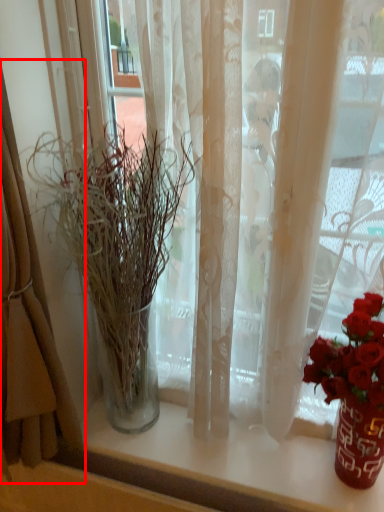
Question: From the image's perspective, where is curtain (annotated by the red box) located in relation to houseplant in the image?

Choices:
 (A) above
 (B) below

Answer: (A)